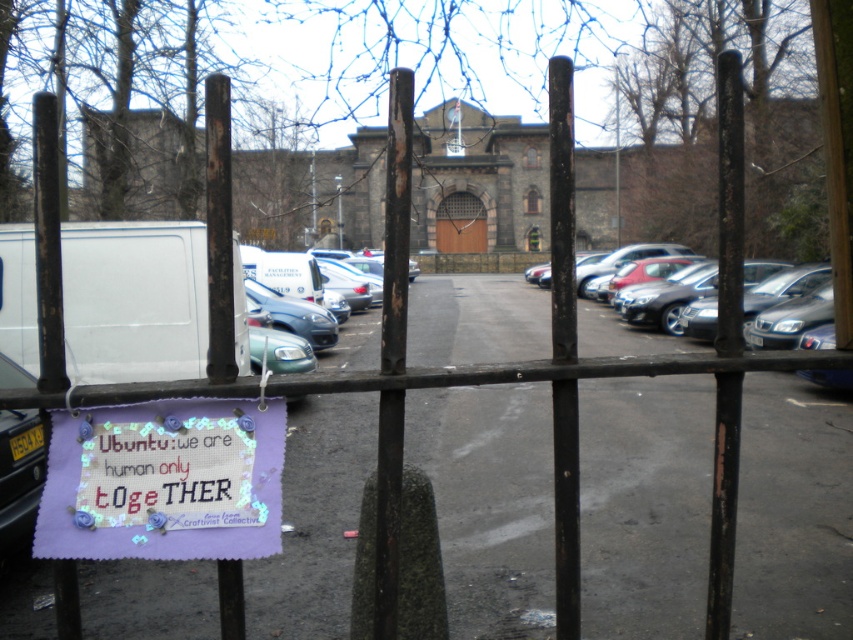
You are a delivery person who needs to park your 15 feet long truck near the brown stone door at center. The shiny silver sedan at right is blocking the path. Can you move your truck around the sedan to park near the door?

The shiny silver sedan at right is 72.55 feet away from the brown stone door at center. Since your truck is 15 feet long, there is enough space to maneuver around the sedan and park near the door.

What is the exact coordinate of the shiny silver sedan at right?

The shiny silver sedan at right is located at coordinate point (659, 284).